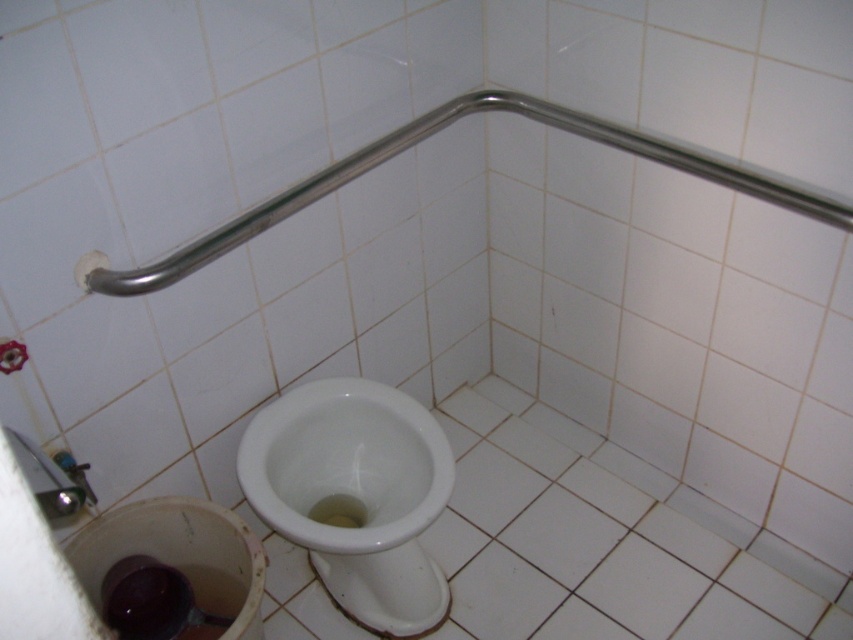
Which is more to the left, white glossy toilet bowl at center or polished stainless steel grab bar at upper center?

white glossy toilet bowl at center is more to the left.

Is white glossy toilet bowl at center to the left of polished stainless steel grab bar at upper center from the viewer's perspective?

Yes, white glossy toilet bowl at center is to the left of polished stainless steel grab bar at upper center.

Is point (399, 624) farther from camera compared to point (148, 275)?

Yes, it is behind point (148, 275).

Where is `white glossy toilet bowl at center`? This screenshot has width=853, height=640. white glossy toilet bowl at center is located at coordinates (355, 493).